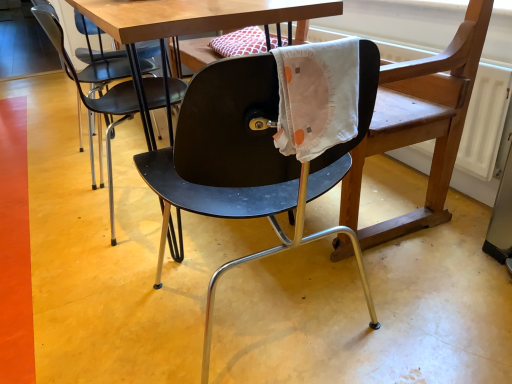
In order to click on vacant region to the left of matte black swivel chair at center in this screenshot , I will do `click(71, 215)`.